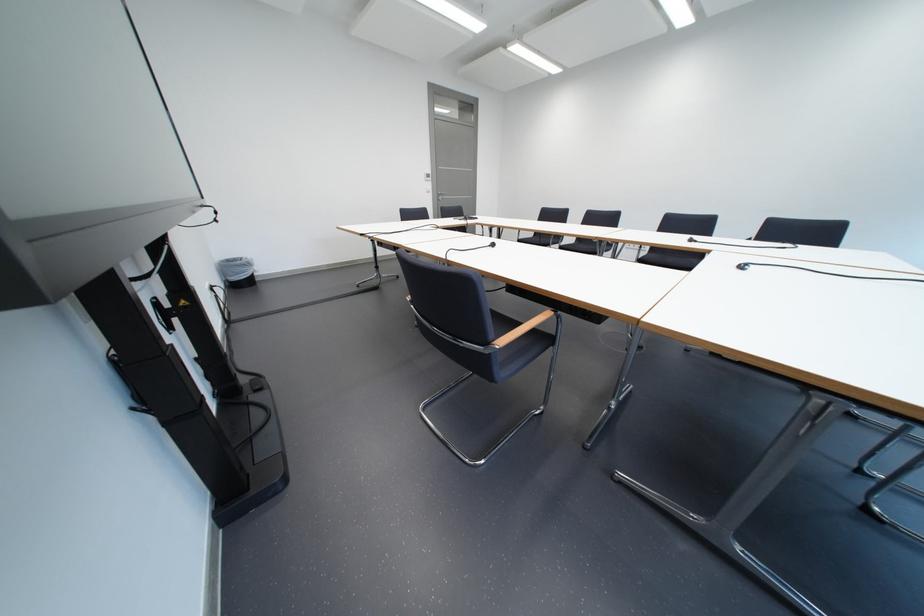
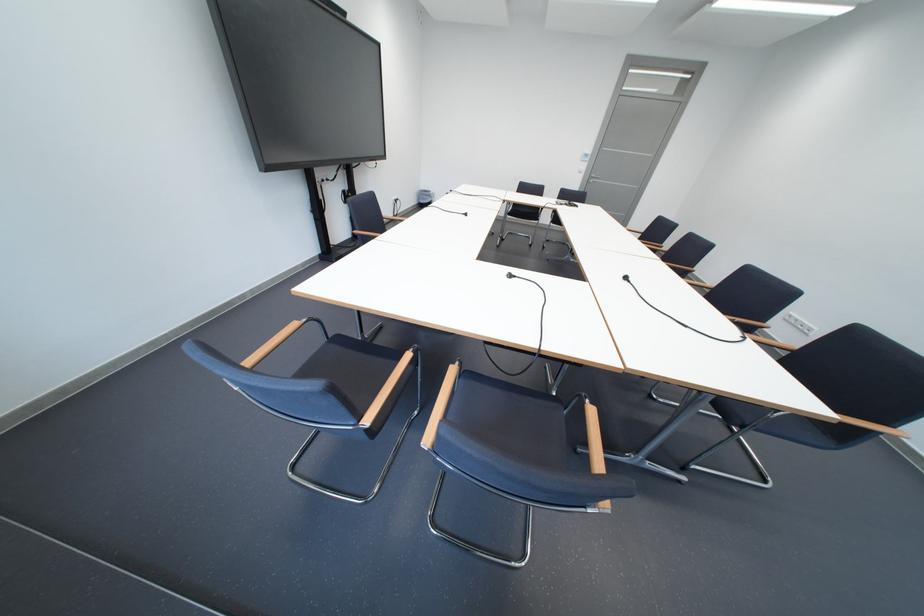
The point at (441,187) is marked in the first image. Where is the corresponding point in the second image?

(596, 168)